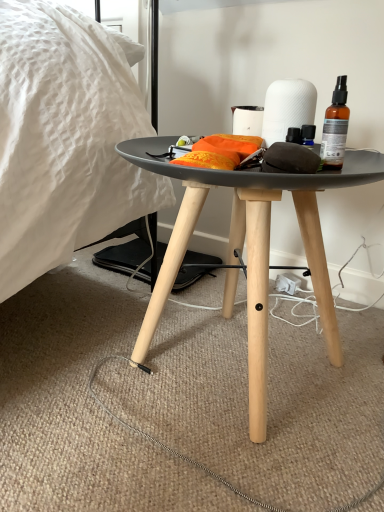
Question: Is orange fabric at center wider or thinner than translucent amber glass spray bottle at upper right?

Choices:
 (A) thin
 (B) wide

Answer: (B)

Question: From a real-world perspective, is orange fabric at center above or below translucent amber glass spray bottle at upper right?

Choices:
 (A) above
 (B) below

Answer: (B)

Question: Which is nearer to the translucent amber glass spray bottle at upper right?

Choices:
 (A) black matte side table at center
 (B) orange fabric at center
 (C) white matte paper towel at center

Answer: (C)

Question: Which is nearer to the white matte paper towel at center?

Choices:
 (A) orange fabric at center
 (B) translucent amber glass spray bottle at upper right
 (C) black matte side table at center

Answer: (B)